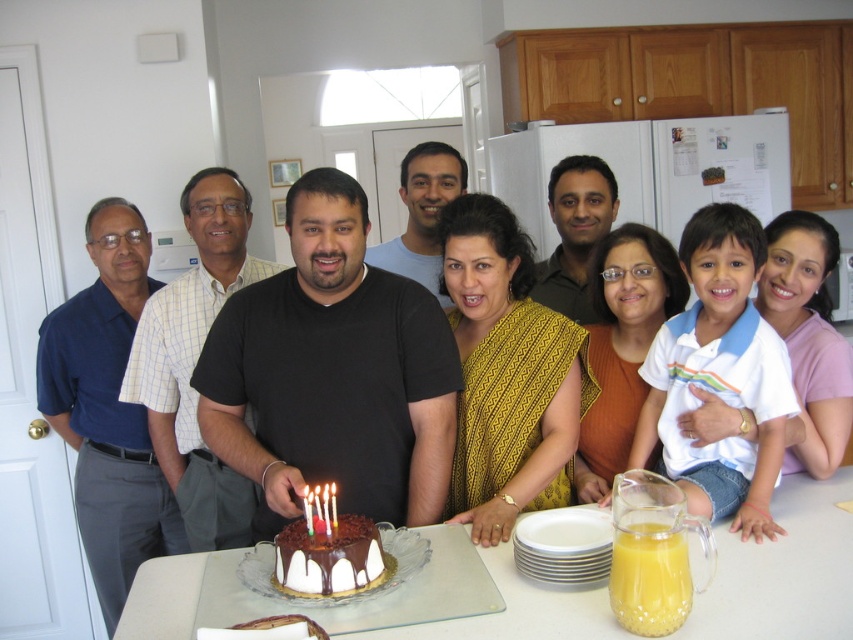
How far apart are matte black shirt at center and chocolate frosted cake at center?

matte black shirt at center is 11.24 inches away from chocolate frosted cake at center.

Image resolution: width=853 pixels, height=640 pixels. I want to click on matte black shirt at center, so click(x=790, y=570).

Between point (701, 609) and point (374, 540), which one is positioned behind?

The point (374, 540) is behind.

Locate an element on the screen. matte black shirt at center is located at coordinates (790, 570).

Can you confirm if matte black shirt at center is taller than translucent glass pitcher at lower right?

Correct, matte black shirt at center is much taller as translucent glass pitcher at lower right.

Can you confirm if matte black shirt at center is positioned to the left of translucent glass pitcher at lower right?

Incorrect, matte black shirt at center is not on the left side of translucent glass pitcher at lower right.

In order to click on matte black shirt at center in this screenshot , I will do `click(790, 570)`.

Does white glass table at center have a larger size compared to chocolate frosted cake at center?

Correct, white glass table at center is larger in size than chocolate frosted cake at center.

Find the location of a particular element. white glass table at center is located at coordinates (784, 572).

Where is `white glass table at center`? The width and height of the screenshot is (853, 640). white glass table at center is located at coordinates (784, 572).